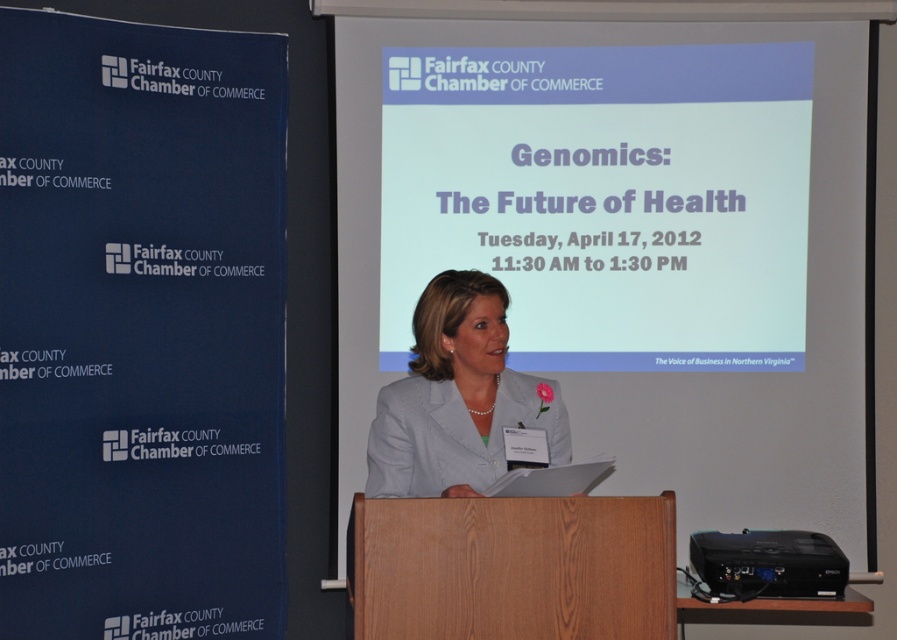
You are an event organizer who needs to adjust the seating arrangement. The speaker is currently standing in front of the white matte projector screen at center and the white fabric jacket at center. Which object is closer to the speaker?

The white fabric jacket at center is behind the white matte projector screen at center, so the white matte projector screen at center is closer to the speaker.

You are an event coordinator setting up the stage for a presentation. You need to place a 3.5 feet wide laptop between the white matte projector screen at center and the wooden podium at center. Can you fit it between them?

The white matte projector screen at center is wider than the wooden podium at center, so the space between them can accommodate the 3.5 feet wide laptop.